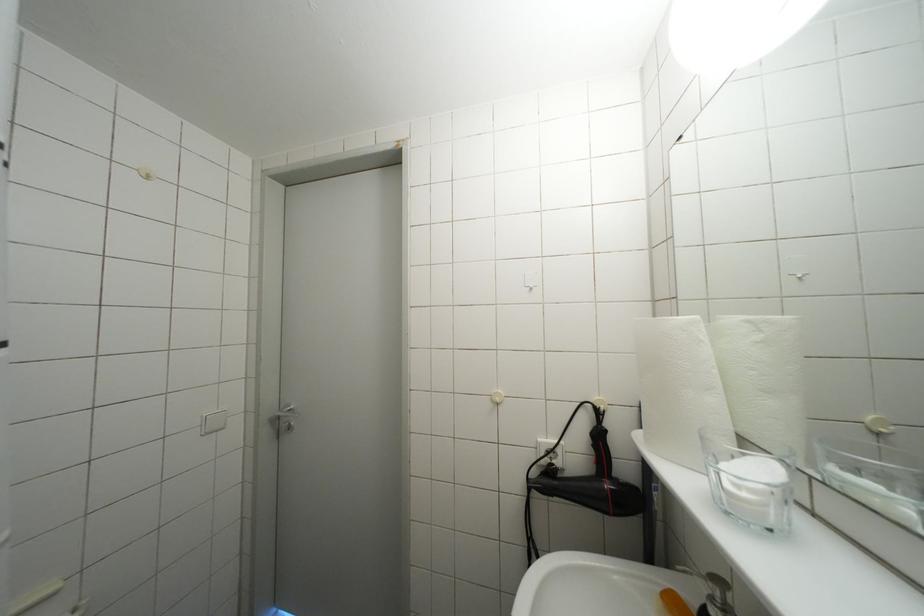
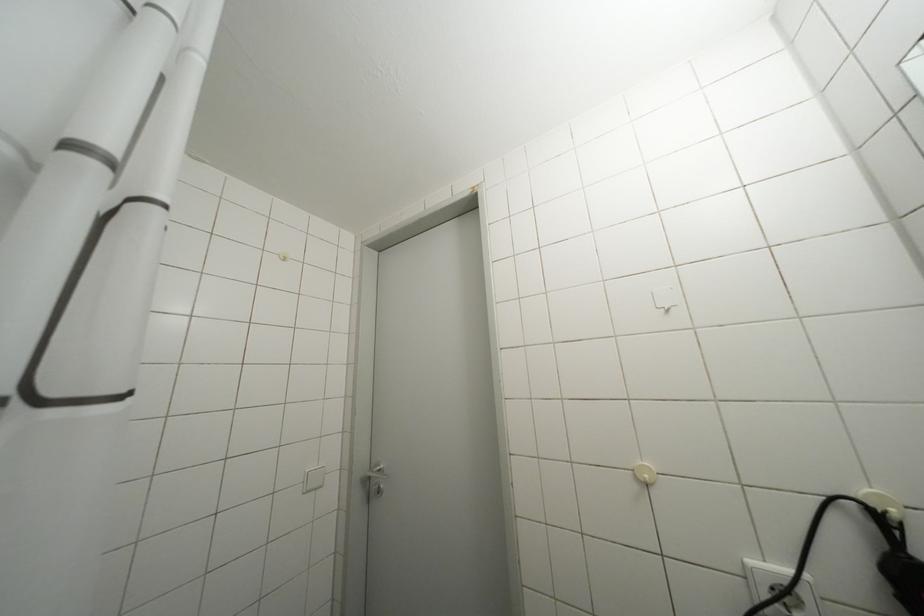
Which direction would the cameraman need to move to produce the second image?

The cameraman walked toward left, forward.